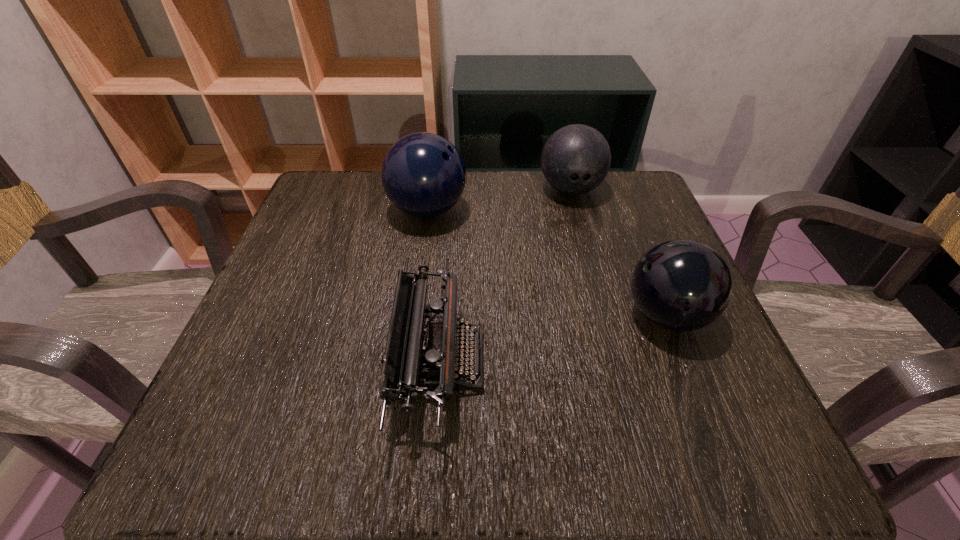
Find the location of `the leftmost bowling ball`. the leftmost bowling ball is located at coordinates (423, 174).

The image size is (960, 540). In order to click on the nearest bowling ball in this screenshot , I will do `click(681, 285)`.

The image size is (960, 540). What are the coordinates of `typewriter` in the screenshot? It's located at (418, 347).

In order to click on free location located 0.120m on the surface of the leftmost bowling ball near the finger holes in this screenshot , I will do `click(519, 211)`.

Find the location of a particular element. The image size is (960, 540). vacant space situated 0.360m on the side of the nearest bowling ball with the finger holes is located at coordinates (419, 316).

Image resolution: width=960 pixels, height=540 pixels. I want to click on free space located on the side of the nearest bowling ball with the finger holes, so click(487, 316).

You are a GUI agent. You are given a task and a screenshot of the screen. Output one action in this format:
    pyautogui.click(x=<x>, y=<y>)
    Task: Click on the vacant space located on the side of the nearest bowling ball with the finger holes
    The height and width of the screenshot is (540, 960).
    Given the screenshot: What is the action you would take?
    pyautogui.click(x=521, y=316)

In order to click on free region located on the typing side of the typewriter in this screenshot , I will do `click(634, 361)`.

Where is `object present at the near edge`? object present at the near edge is located at coordinates (418, 347).

Locate an element on the screen. The width and height of the screenshot is (960, 540). object that is at the far right corner is located at coordinates point(575,160).